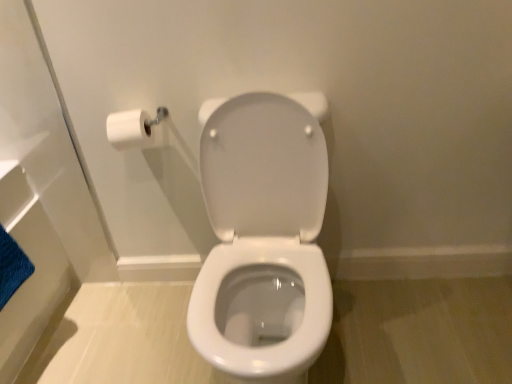
Where is `white glossy toilet at center`? The height and width of the screenshot is (384, 512). white glossy toilet at center is located at coordinates (263, 240).

Describe the element at coordinates (263, 240) in the screenshot. I see `white glossy toilet at center` at that location.

Locate an element on the screen. white glossy toilet at center is located at coordinates (263, 240).